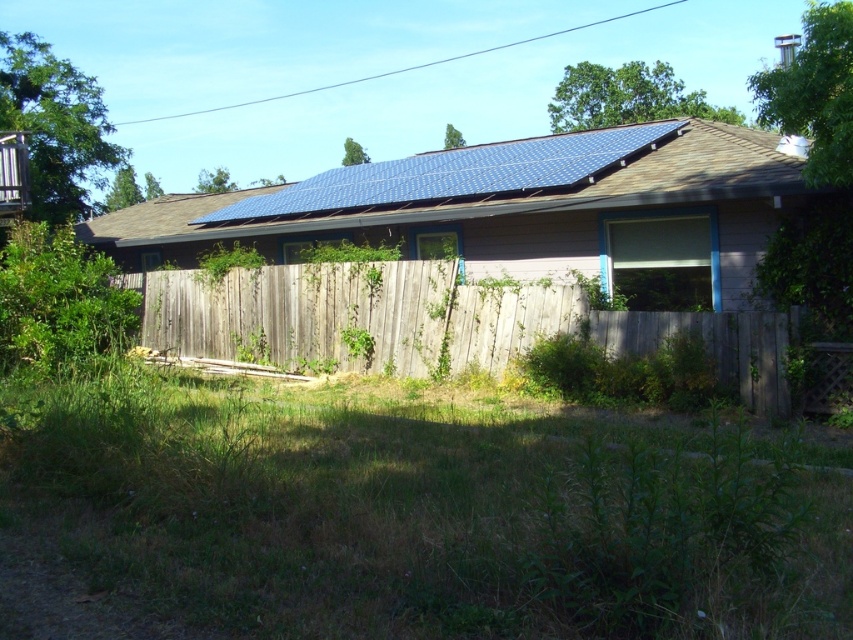
You are standing in the backyard and want to install a new solar panel. The existing blue solar panel at upper center is located at coordinates point 0.327, 0.604. Can you place a new solar panel at point 0.327, 0.604?

The blue solar panel at upper center is already positioned at point (x=514, y=209), so you cannot place a new solar panel there as it is already occupied.

You are a drone operator trying to capture a photo of the blue solar panel at upper center and the weathered wood fence at center. From your current position, which object is closer to you?

The blue solar panel at upper center is closer to you than the weathered wood fence at center because the fence is positioned behind the solar panel.